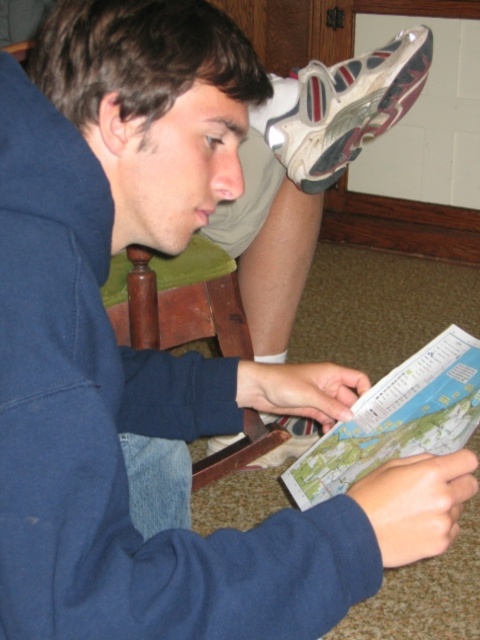
Question: From the image, what is the correct spatial relationship of white mesh shoe at upper right in relation to white leather shoe at lower center?

Choices:
 (A) right
 (B) left

Answer: (A)

Question: Is white mesh shoe at upper right bigger than white leather shoe at lower center?

Choices:
 (A) yes
 (B) no

Answer: (A)

Question: Is white mesh shoe at upper right positioned behind white leather shoe at lower center?

Choices:
 (A) no
 (B) yes

Answer: (A)